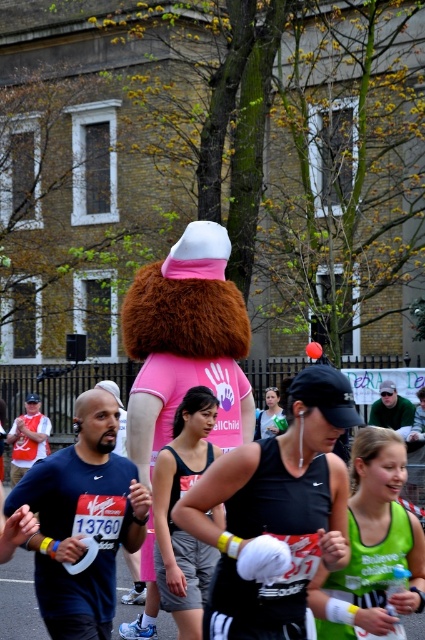
Is point (217, 624) less distant than point (382, 630)?

No, it is behind (382, 630).

You are a GUI agent. You are given a task and a screenshot of the screen. Output one action in this format:
    pyautogui.click(x=<x>, y=<y>)
    Task: Click on the black matte tank top at center
    Image resolution: width=425 pixels, height=640 pixels.
    Given the screenshot: What is the action you would take?
    pyautogui.click(x=275, y=515)

Find the location of a particular element. black matte tank top at center is located at coordinates (275, 515).

Who is positioned more to the right, dark blue athletic shirt at center or green matte tank top at center?

Positioned to the right is green matte tank top at center.

Find the location of a particular element. This screenshot has width=425, height=640. dark blue athletic shirt at center is located at coordinates (82, 520).

Where is `dark blue athletic shirt at center`? This screenshot has height=640, width=425. dark blue athletic shirt at center is located at coordinates (82, 520).

Which is more to the left, pink furry mascot at center or green matte tank top at center?

Positioned to the left is pink furry mascot at center.

What do you see at coordinates (186, 342) in the screenshot? I see `pink furry mascot at center` at bounding box center [186, 342].

Is point (169, 292) positioned after point (373, 445)?

Yes, point (169, 292) is farther from viewer.

Where is `pink furry mascot at center`? This screenshot has height=640, width=425. pink furry mascot at center is located at coordinates (186, 342).